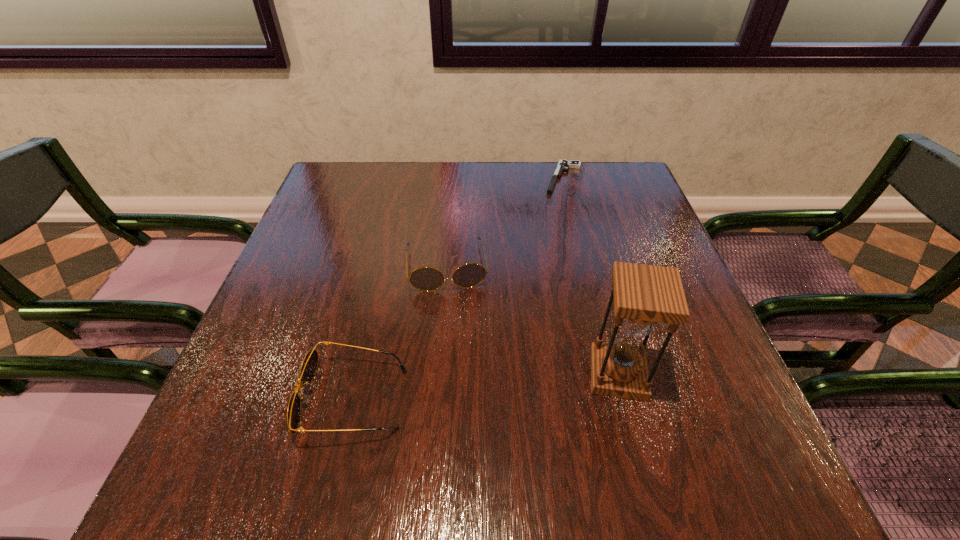
You are a GUI agent. You are given a task and a screenshot of the screen. Output one action in this format:
    pyautogui.click(x=<x>, y=<y>)
    Task: Click on the closest object to the second tallest object
    
    Given the screenshot: What is the action you would take?
    coord(309,365)

Locate which object ranks third in proximity to the third nearest object. Please provide its 2D coordinates. Your answer should be formatted as a tuple, i.e. [(x, y)], where the tuple contains the x and y coordinates of a point satisfying the conditions above.

[(563, 165)]

Image resolution: width=960 pixels, height=540 pixels. I want to click on vacant area in the image that satisfies the following two spatial constraints: 1. on the front side of the tallest object; 2. on the left side of the farther sunglasses, so click(x=438, y=374).